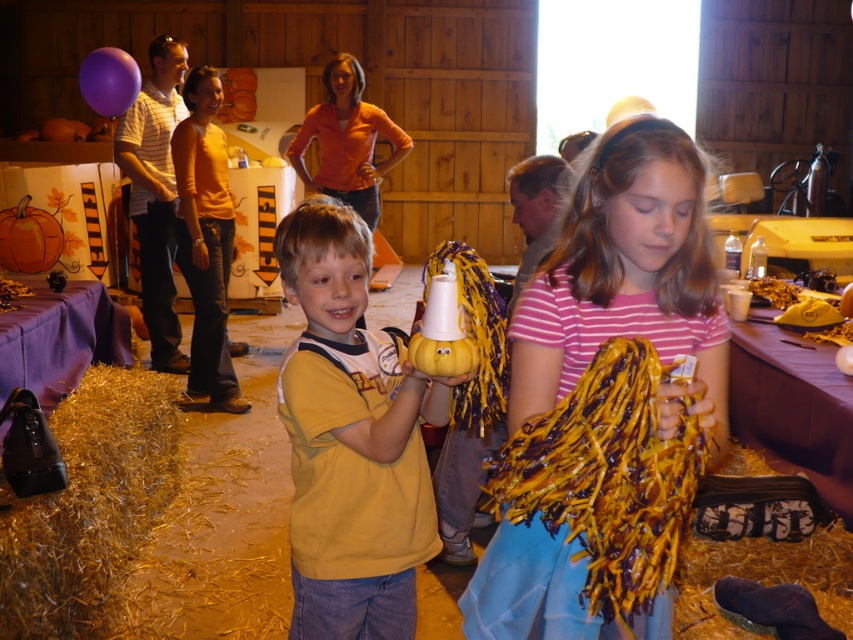
Question: Can you confirm if striped cotton shirt at center is thinner than orange matte pumpkin at left?

Choices:
 (A) yes
 (B) no

Answer: (B)

Question: Which point appears farthest from the camera in this image?

Choices:
 (A) (18, 209)
 (B) (393, 454)
 (C) (604, 566)
 (D) (103, 368)

Answer: (A)

Question: Among these objects, which one is nearest to the camera?

Choices:
 (A) orange matte pumpkin at left
 (B) yellow matte pumpkin at center
 (C) gold shredded hay at lower left
 (D) striped cotton shirt at center

Answer: (D)

Question: Among these objects, which one is farthest from the camera?

Choices:
 (A) orange matte pumpkin at left
 (B) yellow matte pumpkin at center
 (C) gold shredded hay at lower left
 (D) striped cotton shirt at center

Answer: (A)

Question: Can you confirm if yellow matte pumpkin at center is positioned to the left of gold shredded hay at lower left?

Choices:
 (A) yes
 (B) no

Answer: (B)

Question: Does striped cotton shirt at center have a greater width compared to gold shredded hay at lower left?

Choices:
 (A) no
 (B) yes

Answer: (A)